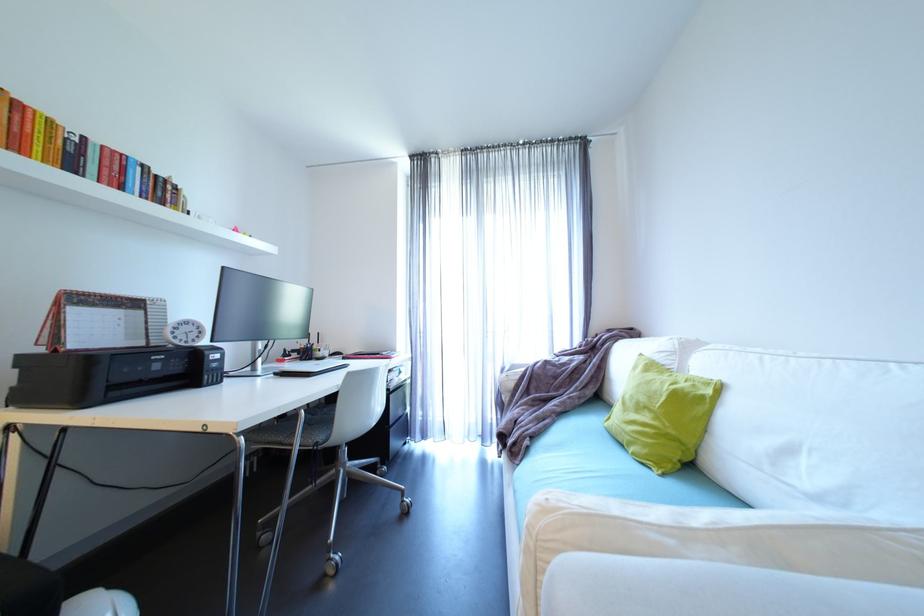
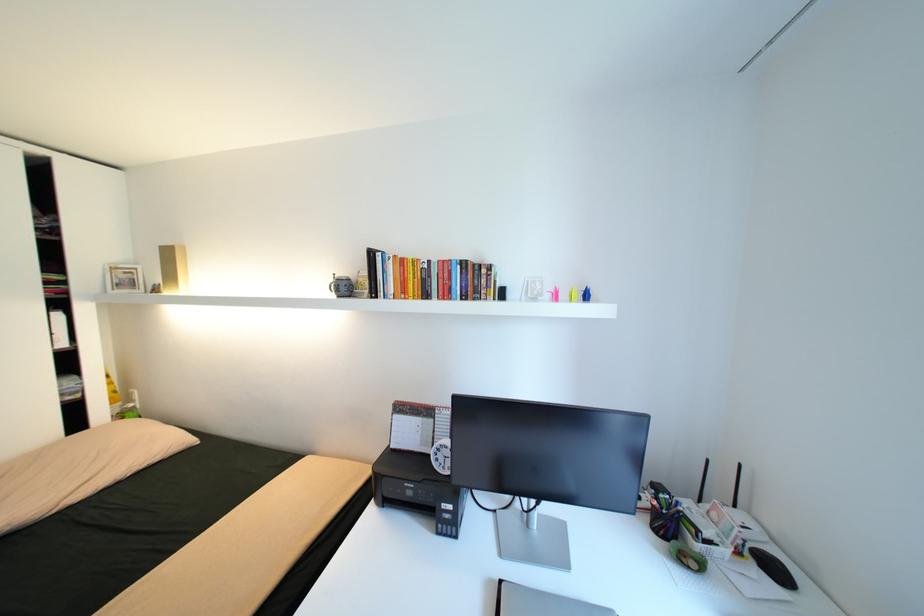
Where in the second image is the point corresponding to [183,338] from the first image?

(444, 460)